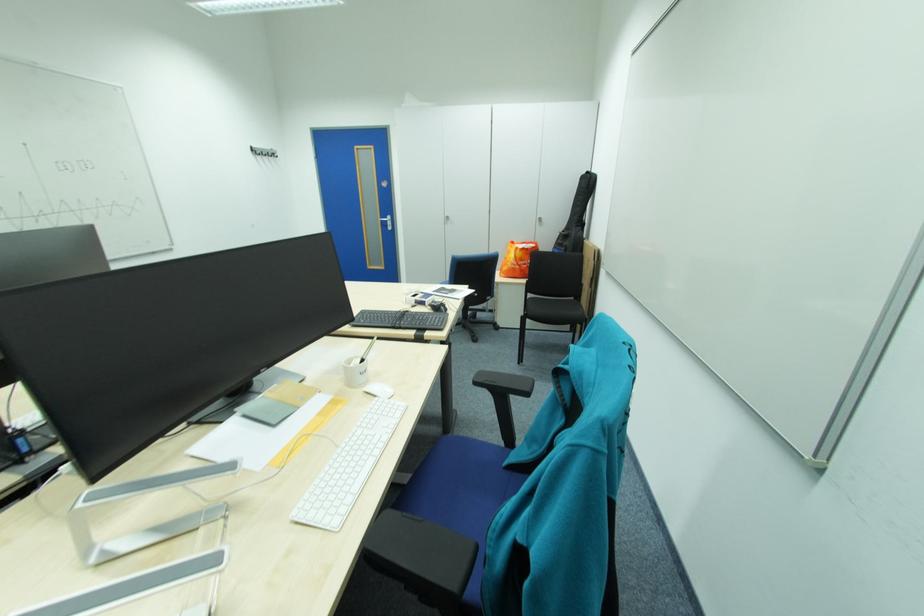
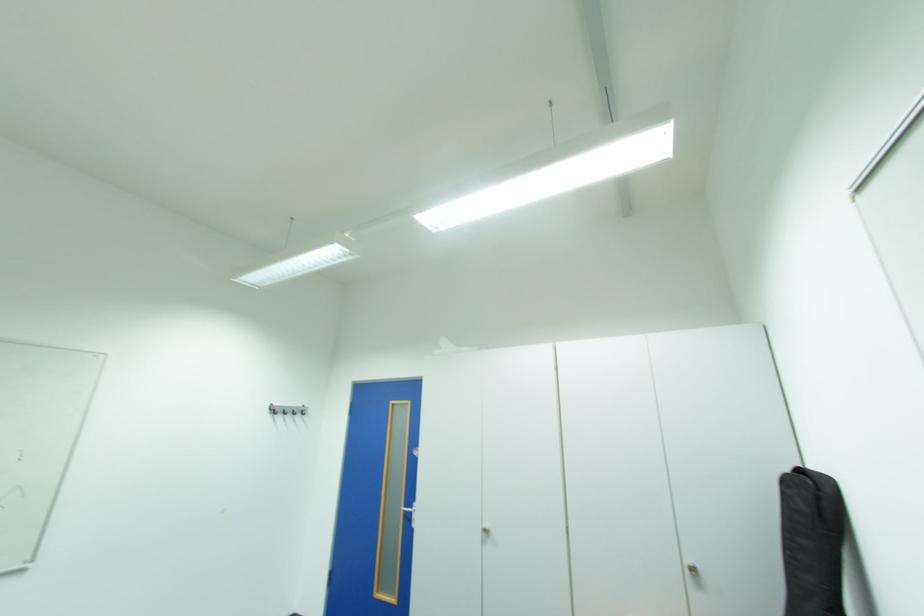
Where in the second image is the point corresponding to the point at 591,177 from the first image?

(795, 482)